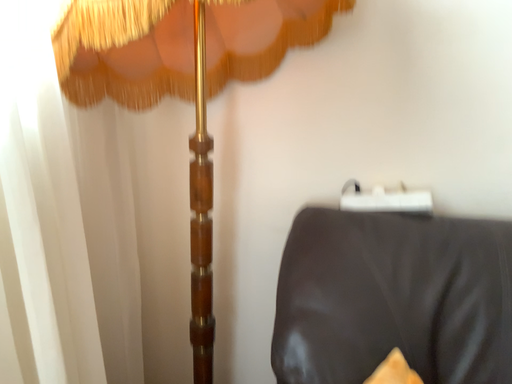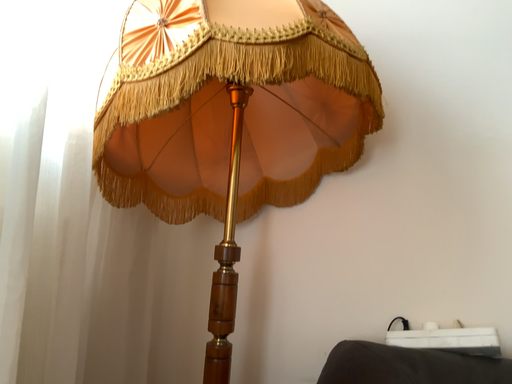
Question: How did the camera likely rotate when shooting the video?

Choices:
 (A) rotated upward
 (B) rotated downward

Answer: (A)